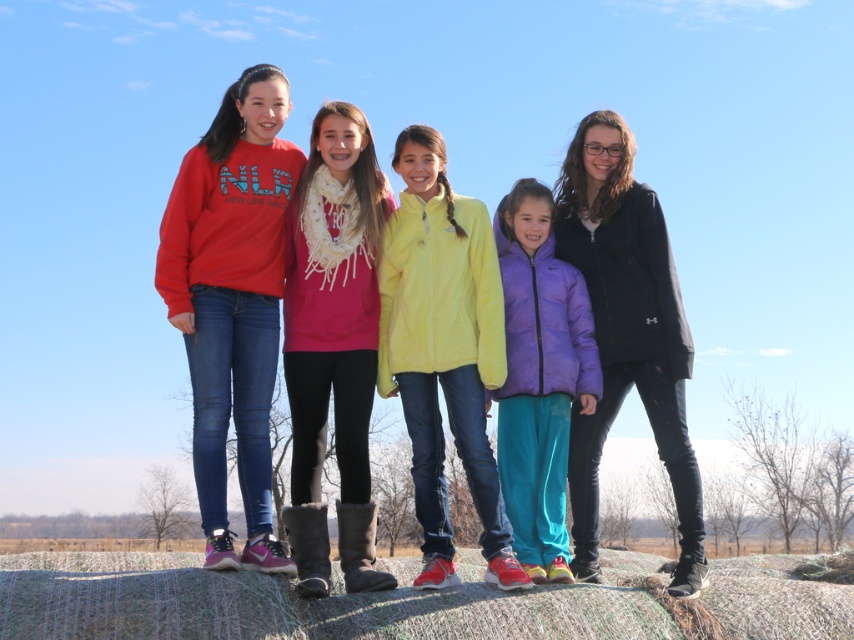
You are trying to decide which jacket to wear for a winter hike. You see the matte fleece jackets at center and the purple puffer jacket at center in the image. Which one is taller?

The matte fleece jackets at center is taller than the purple puffer jacket at center.

You are a photographer trying to capture a group photo of the matte red sweatshirt at left and the purple puffer jacket at center. You want to ensure both subjects are fully visible in the frame. Which subject requires a wider angle to accommodate their clothing width?

The matte red sweatshirt at left requires a wider angle because its width surpasses that of the purple puffer jacket at center.